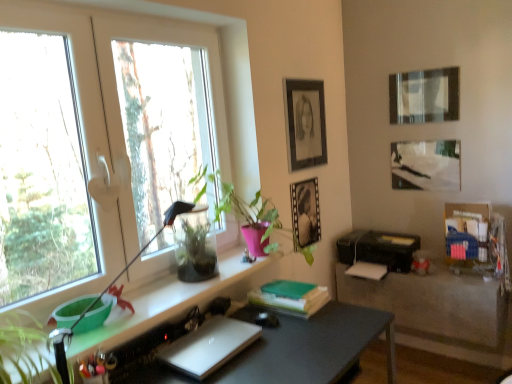
Locate an element on the screen. free spot above translucent glass shelf at left (from a real-world perspective) is located at coordinates (160, 295).